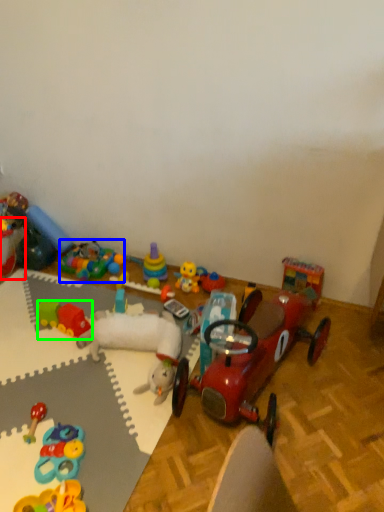
Question: Which object is the closest to the toy (highlighted by a red box)? Choose among these: toy (highlighted by a blue box) or toy (highlighted by a green box).

Choices:
 (A) toy
 (B) toy

Answer: (A)